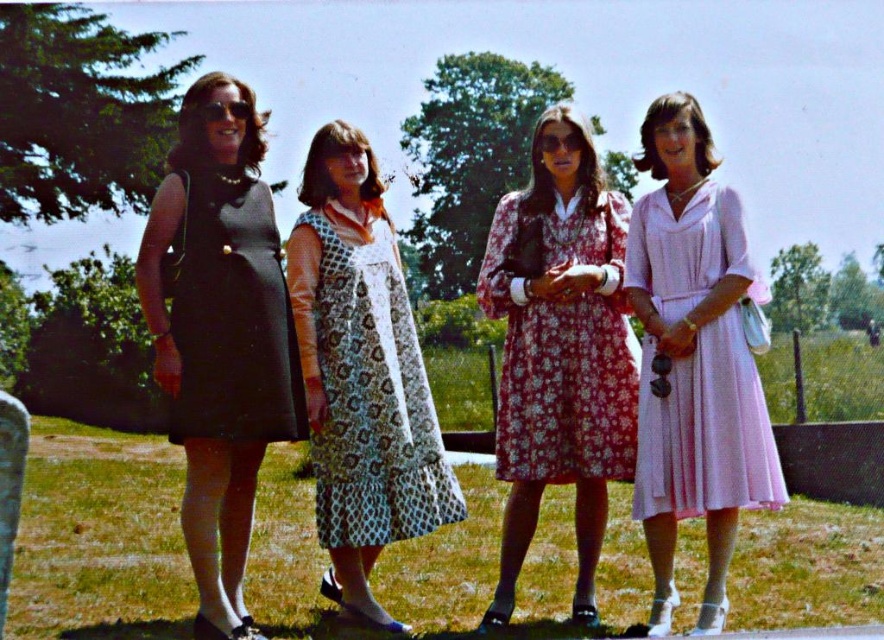
Question: Does printed fabric dress at center have a lesser width compared to floral cotton dress at center?

Choices:
 (A) yes
 (B) no

Answer: (B)

Question: Does matte black dress at left appear on the left side of printed fabric dress at center?

Choices:
 (A) yes
 (B) no

Answer: (A)

Question: Which of the following is the farthest from the observer?

Choices:
 (A) printed fabric dress at center
 (B) pink satin dress at right
 (C) floral cotton dress at center

Answer: (C)

Question: Is printed fabric dress at center thinner than black matte dress at left?

Choices:
 (A) yes
 (B) no

Answer: (B)

Question: Which object is farther from the camera taking this photo?

Choices:
 (A) black matte dress at left
 (B) pink satin dress at right
 (C) printed fabric dress at center
 (D) floral cotton dress at center

Answer: (D)

Question: Which of these objects is positioned closest to the black matte dress at left?

Choices:
 (A) printed fabric dress at center
 (B) pink satin dress at right
 (C) matte black dress at left

Answer: (C)